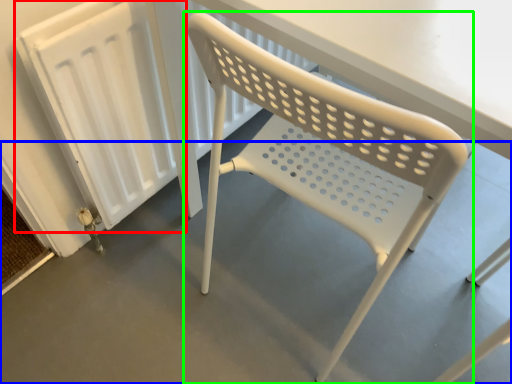
Question: Estimate the real-world distances between objects in this image. Which object is closer to radiator (highlighted by a red box), concrete (highlighted by a blue box) or chair (highlighted by a green box)?

Choices:
 (A) concrete
 (B) chair

Answer: (B)